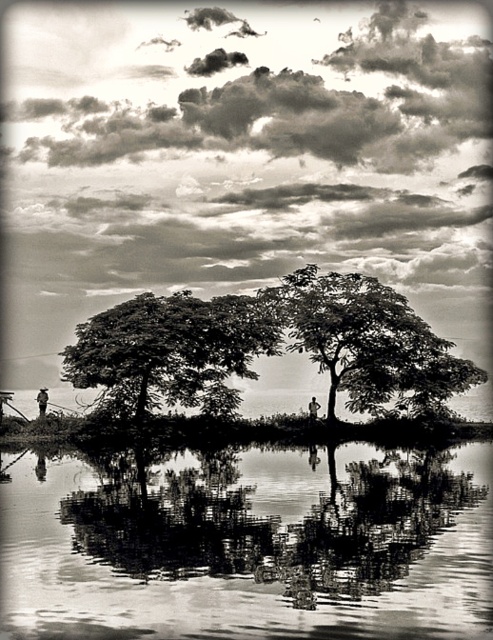
You are a bird flying over the serene natural scene. You want to land on the closest tree to the water. Which tree should you choose between the dark green leafy tree at center and the smooth bark tree at center?

The dark green leafy tree at center is in front of the smooth bark tree at center, so it is closer to the water. Therefore, you should choose the dark green leafy tree at center to land on.

You are a bird looking for a nesting spot. You see the dark green leafy tree at center and the smooth bark tree at center. Which tree is taller and better for nesting?

The smooth bark tree at center is taller than the dark green leafy tree at center, so it would be better for nesting.